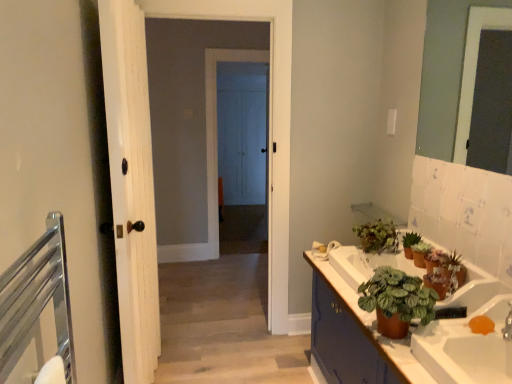
Question: Can you confirm if green matte plant at upper right, which ranks as the 3th houseplant in back-to-front order, is positioned to the left of clear glass mirror at upper right?

Choices:
 (A) no
 (B) yes

Answer: (B)

Question: Is green matte plant at upper right, marked as the second houseplant in a front-to-back arrangement, positioned before clear glass mirror at upper right?

Choices:
 (A) yes
 (B) no

Answer: (B)

Question: Is green matte plant at upper right, which ranks as the 3th houseplant in back-to-front order, thinner than clear glass mirror at upper right?

Choices:
 (A) no
 (B) yes

Answer: (A)

Question: Can you confirm if green matte plant at upper right, which ranks as the 3th houseplant in back-to-front order, is positioned to the right of clear glass mirror at upper right?

Choices:
 (A) yes
 (B) no

Answer: (B)

Question: Is green matte plant at upper right, which ranks as the 3th houseplant in back-to-front order, not near clear glass mirror at upper right?

Choices:
 (A) no
 (B) yes

Answer: (B)

Question: Considering the positions of white wood door at center, which is the 2th door in front-to-back order, and green matte plant at lower right, placed as the fourth houseplant when sorted from back to front, in the image, is white wood door at center, which is the 2th door in front-to-back order, wider or thinner than green matte plant at lower right, placed as the fourth houseplant when sorted from back to front,?

Choices:
 (A) wide
 (B) thin

Answer: (B)

Question: Considering the relative positions of white wood door at center, which is the 2th door in front-to-back order, and green matte plant at lower right, which is the 1th houseplant in front-to-back order, in the image provided, is white wood door at center, which is the 2th door in front-to-back order, to the left or to the right of green matte plant at lower right, which is the 1th houseplant in front-to-back order,?

Choices:
 (A) left
 (B) right

Answer: (A)

Question: In terms of height, does white wood door at center, which is the 2th door in front-to-back order, look taller or shorter compared to green matte plant at lower right, which is the 1th houseplant in front-to-back order?

Choices:
 (A) tall
 (B) short

Answer: (A)

Question: Choose the correct answer: Is white wood door at center, which is the 2th door in front-to-back order, inside green matte plant at lower right, placed as the fourth houseplant when sorted from back to front, or outside it?

Choices:
 (A) outside
 (B) inside

Answer: (A)

Question: Based on their positions, is white glossy sink at lower right located to the left or right of green matte plant at right, placed as the third houseplant when sorted from front to back?

Choices:
 (A) right
 (B) left

Answer: (B)

Question: Is point (481, 311) positioned closer to the camera than point (417, 236)?

Choices:
 (A) farther
 (B) closer

Answer: (B)

Question: Based on their sizes in the image, would you say white glossy sink at lower right is bigger or smaller than green matte plant at right, the 2th houseplant in the back-to-front sequence?

Choices:
 (A) small
 (B) big

Answer: (B)

Question: Considering their positions, is white glossy sink at lower right located in front of or behind green matte plant at right, the 2th houseplant in the back-to-front sequence?

Choices:
 (A) front
 (B) behind

Answer: (A)

Question: In terms of height, does white wood door at left, acting as the 1th door starting from the front, look taller or shorter compared to green matte plant at upper right, the 1th houseplant when ordered from back to front?

Choices:
 (A) short
 (B) tall

Answer: (B)

Question: From the image's perspective, is white wood door at left, acting as the 1th door starting from the front, located above or below green matte plant at upper right, the 1th houseplant when ordered from back to front?

Choices:
 (A) below
 (B) above

Answer: (B)